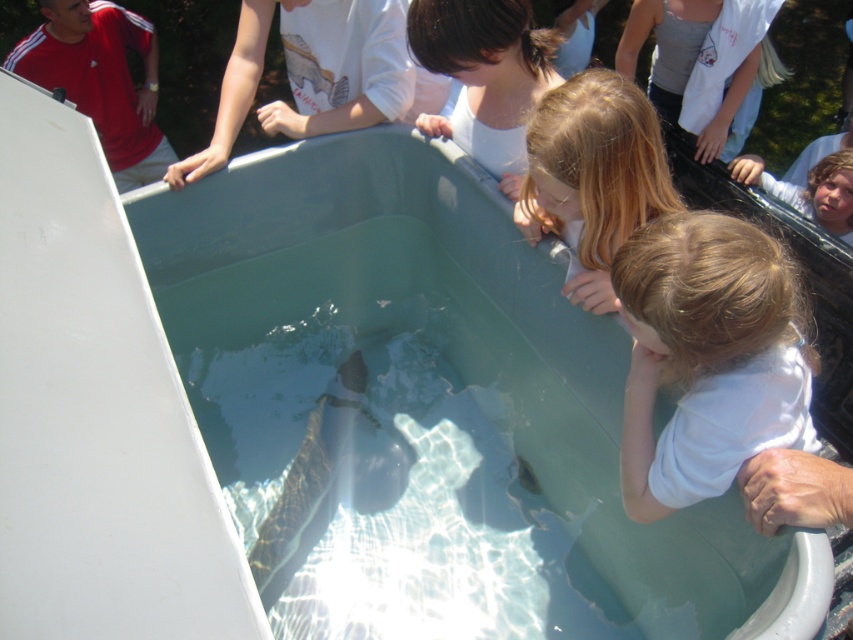
Who is positioned more to the left, light brown hair at lower right or blonde hair at lower center?

From the viewer's perspective, blonde hair at lower center appears more on the left side.

Does light brown hair at lower right have a larger size compared to blonde hair at lower center?

Yes, light brown hair at lower right is bigger than blonde hair at lower center.

The width and height of the screenshot is (853, 640). I want to click on light brown hair at lower right, so click(706, 356).

Which is in front, point (782, 320) or point (489, 19)?

Point (782, 320) is more forward.

Who is positioned more to the left, light brown hair at lower right or brown hair at upper center?

From the viewer's perspective, brown hair at upper center appears more on the left side.

Between point (669, 468) and point (514, 4), which one is positioned in front?

Point (669, 468) is in front.

Identify the location of light brown hair at lower right. (706, 356).

Can you confirm if blonde hair at lower center is positioned above brown hair at upper center?

No, blonde hair at lower center is not above brown hair at upper center.

Consider the image. Is blonde hair at lower center wider than brown hair at upper center?

No, blonde hair at lower center is not wider than brown hair at upper center.

I want to click on blonde hair at lower center, so click(x=593, y=173).

Locate an element on the screen. The width and height of the screenshot is (853, 640). blonde hair at lower center is located at coordinates (593, 173).